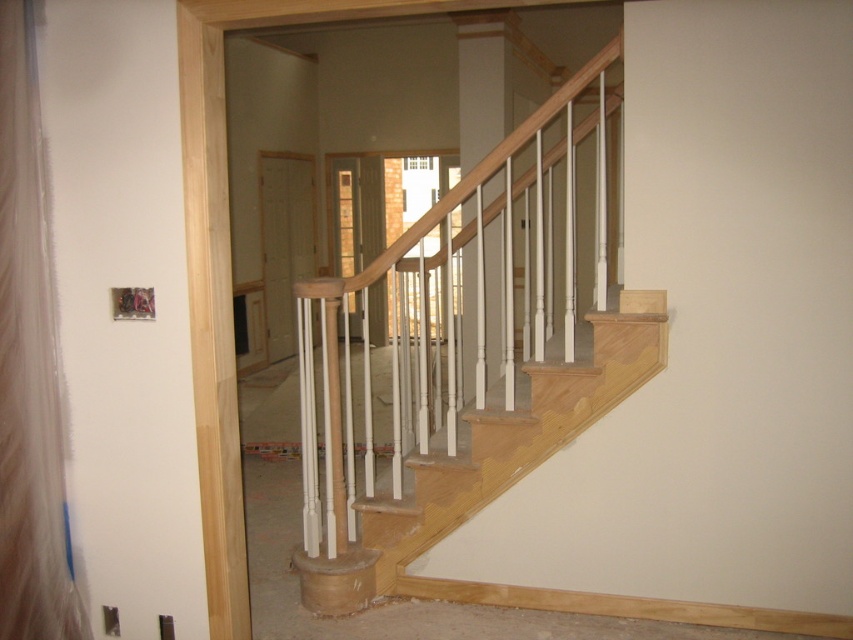
From the picture: You are a contractor inspecting the unfinished staircase. You notice the natural wood handrail at center and the light wood stairwell at center. Which object is positioned to the right side of the other?

The natural wood handrail at center is to the right of the light wood stairwell at center.

You are standing at the base of the staircase in the construction site and see two points marked on the wall. The first point is at coordinates point (566, 102) and the second is at point (584, 358). Which point is closer to you?

Point (566, 102) is closer to the viewer than point (584, 358).

You are a contractor measuring the height of the natural wood handrail at center and the light wood stairwell at center in the construction site. Which object has a greater height?

The natural wood handrail at center is taller than the light wood stairwell at center.